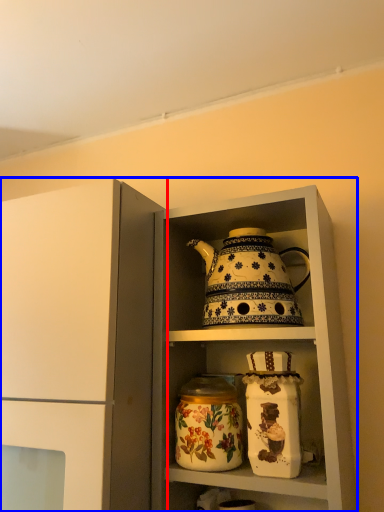
Question: Which object is further to the camera taking this photo, cupboard (highlighted by a red box) or cabinetry (highlighted by a blue box)?

Choices:
 (A) cupboard
 (B) cabinetry

Answer: (B)